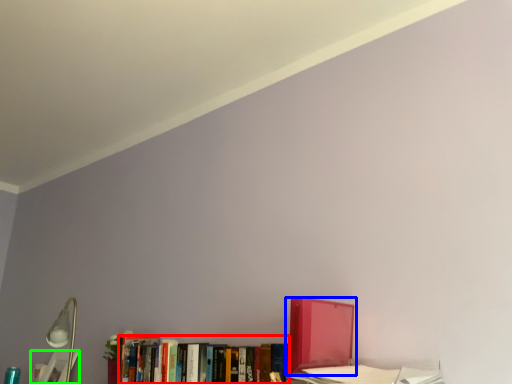
Question: Considering the real-world distances, which object is farthest from book (highlighted by a red box)? book (highlighted by a blue box) or book (highlighted by a green box)?

Choices:
 (A) book
 (B) book

Answer: (B)